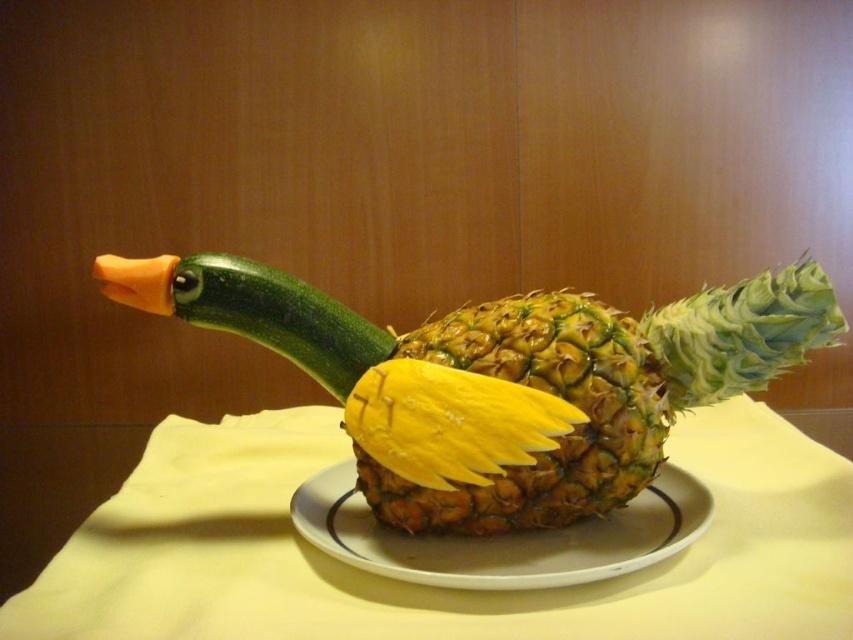
Question: Among these points, which one is nearest to the camera?

Choices:
 (A) (596, 400)
 (B) (341, 506)
 (C) (782, 548)

Answer: (A)

Question: Estimate the real-world distances between objects in this image. Which object is closer to the white ceramic plate at center?

Choices:
 (A) yellow fabric at center
 (B) yellow textured pineapple at center

Answer: (A)

Question: Among these points, which one is nearest to the camera?

Choices:
 (A) (676, 333)
 (B) (392, 593)

Answer: (B)

Question: Observing the image, what is the correct spatial positioning of yellow textured pineapple at center in reference to white ceramic plate at center?

Choices:
 (A) below
 (B) above

Answer: (B)

Question: Can you confirm if yellow fabric at center is positioned above yellow textured pineapple at center?

Choices:
 (A) yes
 (B) no

Answer: (B)

Question: Can you confirm if yellow fabric at center is wider than yellow textured pineapple at center?

Choices:
 (A) no
 (B) yes

Answer: (B)